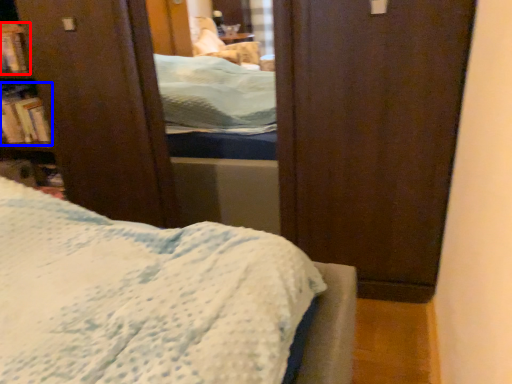
Question: Among these objects, which one is nearest to the camera, book (highlighted by a red box) or book (highlighted by a blue box)?

Choices:
 (A) book
 (B) book

Answer: (A)